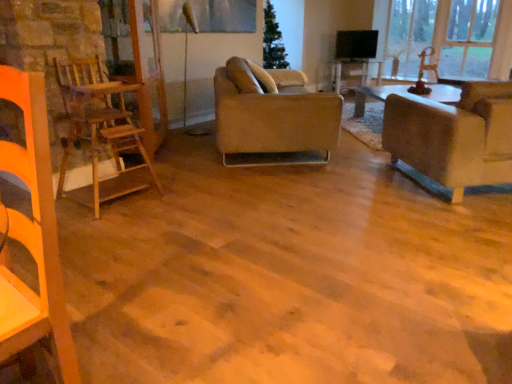
Question: From a real-world perspective, is transparent glass window at upper right positioned above or below wooden ladder at left?

Choices:
 (A) above
 (B) below

Answer: (A)

Question: Looking at their shapes, would you say transparent glass window at upper right is wider or thinner than wooden ladder at left?

Choices:
 (A) thin
 (B) wide

Answer: (A)

Question: Based on their relative distances, which object is nearer to the leather couch at center, the 1th studio couch from the left?

Choices:
 (A) wooden table at center
 (B) transparent wood glass door at left
 (C) wooden ladder at left
 (D) metallic glass window screen at upper center
 (E) matte beige couch at right, the second studio couch when ordered from left to right

Answer: (B)

Question: Based on their relative distances, which object is farther from the wooden table at center?

Choices:
 (A) metallic glass window screen at upper center
 (B) matte beige couch at right, the second studio couch when ordered from left to right
 (C) wooden ladder at left
 (D) transparent wood glass door at left
 (E) leather couch at center, the 1th studio couch from the left

Answer: (C)